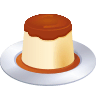
Identify the location of bright white light reflection. This screenshot has height=96, width=96. click(x=75, y=75).